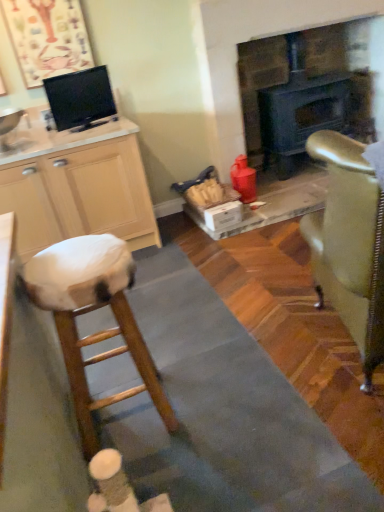
The height and width of the screenshot is (512, 384). Find the location of `gold metallic chair at right`. gold metallic chair at right is located at coordinates (349, 245).

Image resolution: width=384 pixels, height=512 pixels. What do you see at coordinates (286, 71) in the screenshot?
I see `matte black fireplace at center` at bounding box center [286, 71].

What do you see at coordinates (10, 126) in the screenshot?
I see `white glossy sink at left` at bounding box center [10, 126].

At what (x,y) coordinates should I click in order to perform the action: click on wooden stool at left. Please return your answer as a coordinate pair (x, y). The image size is (384, 512). Looking at the image, I should click on (90, 311).

Locate an element on the screen. gold metallic chair at right is located at coordinates (349, 245).

Which is behind, beige wood cabinet at left or black glossy tv at upper left?

black glossy tv at upper left is further from the camera.

Is beige wood cabinet at left at the left side of black glossy tv at upper left?

Indeed, beige wood cabinet at left is positioned on the left side of black glossy tv at upper left.

Based on the photo, would you say beige wood cabinet at left contains black glossy tv at upper left?

No, black glossy tv at upper left is not surrounded by beige wood cabinet at left.

Would you say beige wood cabinet at left is a long distance from black glossy tv at upper left?

No, beige wood cabinet at left is not far away from black glossy tv at upper left.

Considering the sizes of objects beige wood cabinet at left and wooden stool at left in the image provided, who is smaller, beige wood cabinet at left or wooden stool at left?

wooden stool at left is smaller.

Is beige wood cabinet at left looking in the opposite direction of wooden stool at left?

No, beige wood cabinet at left is not facing the opposite direction of wooden stool at left.

The image size is (384, 512). In the image, there is a beige wood cabinet at left. What are the coordinates of `stool below it (from the image's perspective)` in the screenshot? It's located at (90, 311).

Which object is closer to the camera, beige wood cabinet at left or wooden stool at left?

wooden stool at left is in front.

Who is shorter, matte black fireplace at center or white glossy sink at left?

With less height is white glossy sink at left.

From the image's perspective, which object appears higher, matte black fireplace at center or white glossy sink at left?

From the image's view, matte black fireplace at center is above.

Which of these two, matte black fireplace at center or white glossy sink at left, is wider?

matte black fireplace at center.

From a real-world perspective, between black glossy tv at upper left and beige wood cabinet at left, who is vertically lower?

beige wood cabinet at left is physically lower.

Based on their positions, is black glossy tv at upper left located to the left or right of beige wood cabinet at left?

Clearly, black glossy tv at upper left is on the right of beige wood cabinet at left in the image.

Between black glossy tv at upper left and beige wood cabinet at left, which one has smaller size?

Smaller between the two is black glossy tv at upper left.

Which of these two, white glossy sink at left or beige wood cabinet at left, stands shorter?

With less height is white glossy sink at left.

Is point (4, 129) less distant than point (59, 237)?

Yes, point (4, 129) is closer to viewer.

Based on the photo, from the image's perspective, is white glossy sink at left located beneath beige wood cabinet at left?

No, from the image's perspective, white glossy sink at left is not beneath beige wood cabinet at left.

From a real-world perspective, which is physically above, white glossy sink at left or beige wood cabinet at left?

In real-world perspective, white glossy sink at left is above.

Do you think beige wood cabinet at left is within gold metallic chair at right, or outside of it?

beige wood cabinet at left is located beyond the bounds of gold metallic chair at right.

Does beige wood cabinet at left appear on the right side of gold metallic chair at right?

Incorrect, beige wood cabinet at left is not on the right side of gold metallic chair at right.

There is a beige wood cabinet at left. Where is `chair above it (from a real-world perspective)`? The height and width of the screenshot is (512, 384). chair above it (from a real-world perspective) is located at coordinates (349, 245).

Which is closer to the camera, (69,215) or (358,201)?

Point (69,215) is positioned farther from the camera compared to point (358,201).

Between black glossy tv at upper left and wooden stool at left, which one has smaller size?

black glossy tv at upper left is smaller.

The height and width of the screenshot is (512, 384). I want to click on appliance that is above the wooden stool at left (from a real-world perspective), so click(x=80, y=98).

From the picture: Which object is more forward, black glossy tv at upper left or wooden stool at left?

wooden stool at left is more forward.

Identify the location of appliance that appears behind the beige wood cabinet at left. (80, 98).

The height and width of the screenshot is (512, 384). What are the coordinates of `cabinetry above the wooden stool at left (from the image's perspective)` in the screenshot? It's located at (78, 187).

From the image, which object appears to be farther from gold metallic chair at right, black glossy tv at upper left or wooden stool at left?

black glossy tv at upper left is positioned further to the anchor gold metallic chair at right.

Estimate the real-world distances between objects in this image. Which object is further from gold metallic chair at right, white glossy sink at left or beige wood cabinet at left?

Among the two, white glossy sink at left is located further to gold metallic chair at right.

Considering their positions, is beige wood cabinet at left positioned further to matte black fireplace at center than gold metallic chair at right?

Based on the image, gold metallic chair at right appears to be further to matte black fireplace at center.

Estimate the real-world distances between objects in this image. Which object is further from gold metallic chair at right, beige wood cabinet at left or white glossy sink at left?

white glossy sink at left is positioned further to the anchor gold metallic chair at right.

From the image, which object appears to be nearer to matte black fireplace at center, gold metallic chair at right or wooden stool at left?

gold metallic chair at right is positioned closer to the anchor matte black fireplace at center.

Estimate the real-world distances between objects in this image. Which object is further from matte black fireplace at center, gold metallic chair at right or black glossy tv at upper left?

gold metallic chair at right.

Based on their spatial positions, is wooden stool at left or black glossy tv at upper left further from gold metallic chair at right?

black glossy tv at upper left.

From the picture: Which object lies nearer to the anchor point gold metallic chair at right, beige wood cabinet at left or matte black fireplace at center?

beige wood cabinet at left lies closer to gold metallic chair at right than the other object.

This screenshot has width=384, height=512. I want to click on cabinetry between white glossy sink at left and gold metallic chair at right in the horizontal direction, so click(x=78, y=187).

Image resolution: width=384 pixels, height=512 pixels. In order to click on stool positioned between gold metallic chair at right and beige wood cabinet at left from near to far in this screenshot , I will do `click(90, 311)`.

In order to click on appliance between gold metallic chair at right and matte black fireplace at center from front to back in this screenshot , I will do `click(80, 98)`.

Where is `appliance between white glossy sink at left and gold metallic chair at right from left to right`? This screenshot has width=384, height=512. appliance between white glossy sink at left and gold metallic chair at right from left to right is located at coordinates (80, 98).